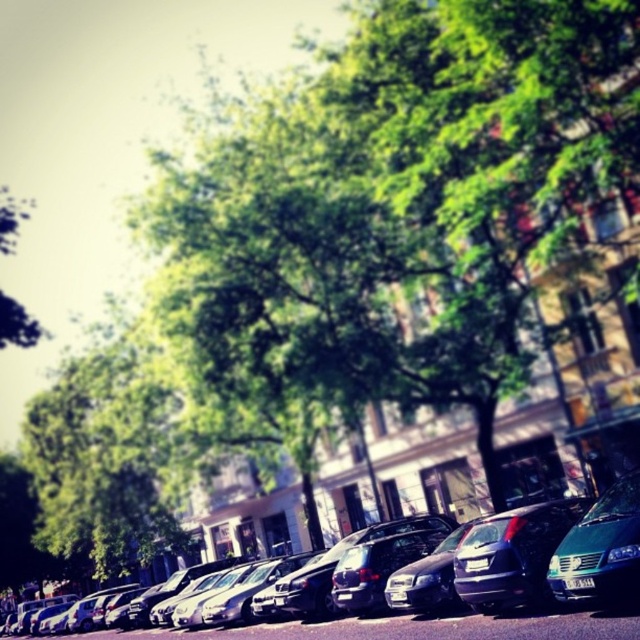
You are a delivery person standing at the teal matte van at lower right, and you need to deliver a package to the green leafy tree at center. The delivery robot you have can only travel 20 meters. Can it make the delivery?

The green leafy tree at center is 21.28 meters away from the teal matte van at lower right. Since the robot can only travel 20 meters, it cannot make the delivery.

Based on the photo, you are a delivery driver who needs to park your teal matte van at lower right. There is a green leafy tree at center blocking the parking spot. Can you fit your van into the parking space without hitting the tree?

The green leafy tree at center is larger in size than the teal matte van at lower right. Since the tree is bigger, there might not be enough space for the van to park without hitting it. Check the dimensions carefully before attempting to park.